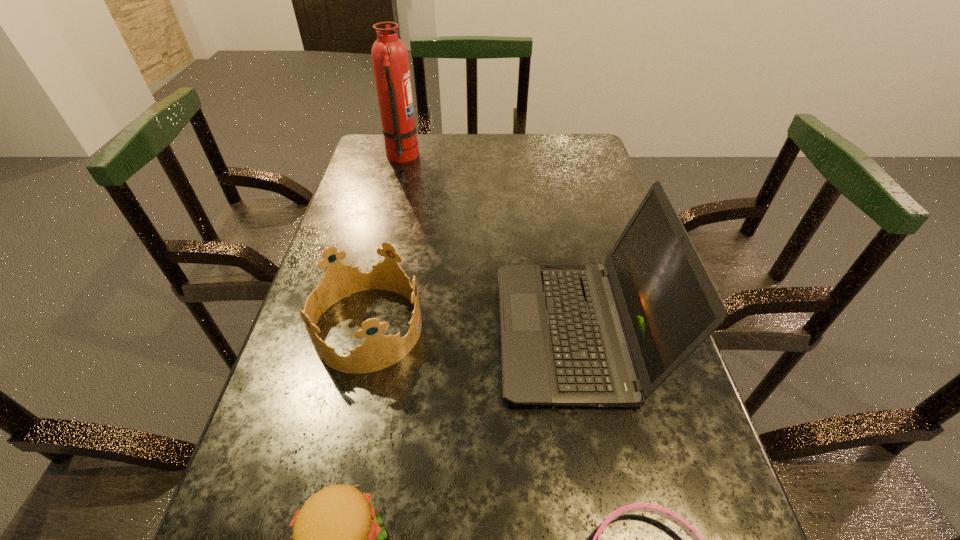
Where is `fire extinguisher located in the left edge section of the desktop`? This screenshot has height=540, width=960. fire extinguisher located in the left edge section of the desktop is located at coordinates (389, 55).

At what (x,y) coordinates should I click in order to perform the action: click on tiara at the left edge. Please return your answer as a coordinate pair (x, y). Looking at the image, I should click on (378, 351).

Where is `object that is at the right edge`? object that is at the right edge is located at coordinates (609, 335).

Locate an element on the screen. The image size is (960, 540). object at the far left corner is located at coordinates (389, 55).

In the image, there is a desktop. Where is `free space at the far edge`? Image resolution: width=960 pixels, height=540 pixels. free space at the far edge is located at coordinates pyautogui.click(x=520, y=166).

This screenshot has height=540, width=960. I want to click on vacant space at the left edge of the desktop, so click(x=357, y=217).

At what (x,y) coordinates should I click in order to perform the action: click on blank space at the right edge of the desktop. Please return your answer as a coordinate pair (x, y). Looking at the image, I should click on (708, 446).

Image resolution: width=960 pixels, height=540 pixels. In the image, there is a desktop. In order to click on vacant area at the far left corner in this screenshot , I will do `click(397, 162)`.

The width and height of the screenshot is (960, 540). In order to click on vacant space at the far right corner of the desktop in this screenshot , I will do `click(563, 150)`.

Find the location of a particular element. The image size is (960, 540). vacant area between the tallest object and the second tallest object is located at coordinates (488, 244).